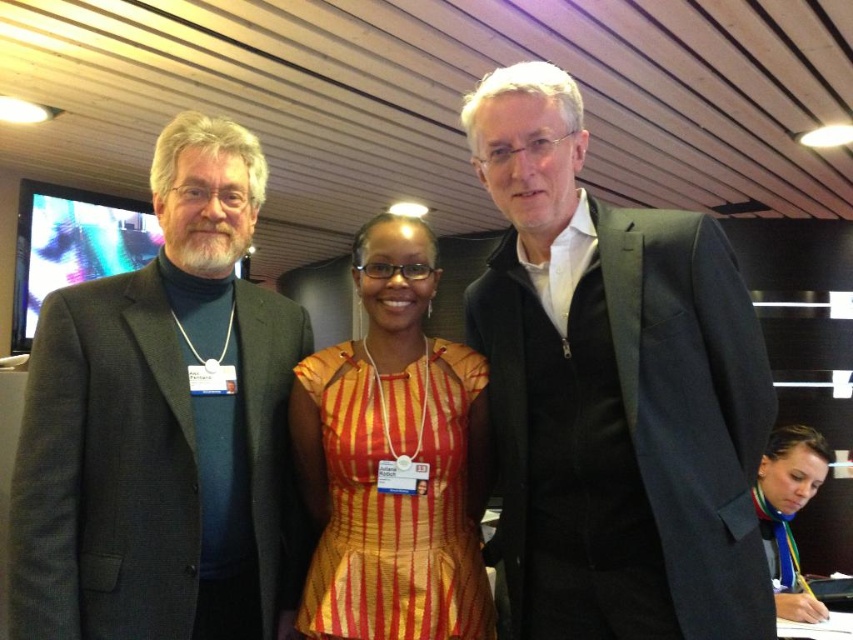
This screenshot has width=853, height=640. Describe the element at coordinates (613, 392) in the screenshot. I see `matte black suit at center` at that location.

Who is lower down, matte black suit at center or orange striped dress at center?

orange striped dress at center is lower down.

Is point (529, 497) closer to camera compared to point (398, 240)?

That is True.

This screenshot has width=853, height=640. In order to click on matte black suit at center in this screenshot , I will do `click(613, 392)`.

Is matte black suit at center smaller than dark gray suit at left?

No, matte black suit at center is not smaller than dark gray suit at left.

Is point (509, 179) in front of point (149, 428)?

That is True.

Does point (665, 403) come farther from viewer compared to point (184, 616)?

No, (665, 403) is closer to viewer.

At what (x,y) coordinates should I click in order to perform the action: click on matte black suit at center. Please return your answer as a coordinate pair (x, y). Looking at the image, I should click on (613, 392).

Is matte black suit at center shorter than matte black jacket at lower right?

No, matte black suit at center is not shorter than matte black jacket at lower right.

Who is more forward, [633,544] or [767,556]?

Point [633,544]

You are a GUI agent. You are given a task and a screenshot of the screen. Output one action in this format:
    pyautogui.click(x=<x>, y=<y>)
    Task: Click on the matte black suit at center
    
    Given the screenshot: What is the action you would take?
    pyautogui.click(x=613, y=392)